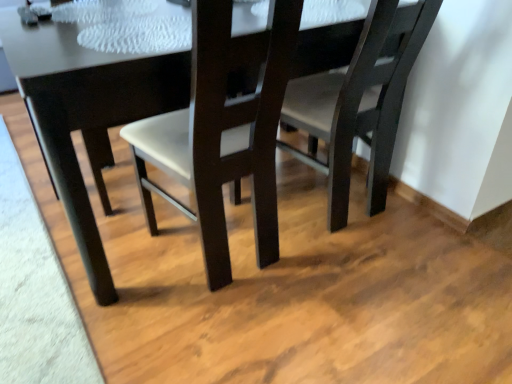
Measure the distance between matte dark wood chair at center, which ranks as the 1th chair in right-to-left order, and camera.

matte dark wood chair at center, which ranks as the 1th chair in right-to-left order, and camera are 3.91 feet apart from each other.

How much space does matte dark wood chair at center, which ranks as the first chair in left-to-right order, occupy vertically?

93.90 centimeters.

Identify the location of matte black table at center. This screenshot has width=512, height=384. (86, 112).

Considering their positions, is matte dark wood chair at center, which ranks as the first chair in left-to-right order, located in front of or behind matte dark wood chair at center, which ranks as the 1th chair in right-to-left order?

Clearly, matte dark wood chair at center, which ranks as the first chair in left-to-right order, is in front of matte dark wood chair at center, which ranks as the 1th chair in right-to-left order.

Looking at this image, from a real-world perspective, which object stands above the other?

matte dark wood chair at center, the second chair when ordered from right to left, is physically above.

In terms of height, does matte dark wood chair at center, the second chair when ordered from right to left, look taller or shorter compared to matte dark wood chair at center, which is counted as the second chair, starting from the left?

Considering their sizes, matte dark wood chair at center, the second chair when ordered from right to left, has more height than matte dark wood chair at center, which is counted as the second chair, starting from the left.

Considering the sizes of matte dark wood chair at center, which is counted as the second chair, starting from the left, and matte dark wood chair at center, the second chair when ordered from right to left, in the image, is matte dark wood chair at center, which is counted as the second chair, starting from the left, wider or thinner than matte dark wood chair at center, the second chair when ordered from right to left,?

Clearly, matte dark wood chair at center, which is counted as the second chair, starting from the left, has less width compared to matte dark wood chair at center, the second chair when ordered from right to left.

Is matte dark wood chair at center, which ranks as the 1th chair in right-to-left order, far from matte dark wood chair at center, the second chair when ordered from right to left?

No, matte dark wood chair at center, which ranks as the 1th chair in right-to-left order, is not far away from matte dark wood chair at center, the second chair when ordered from right to left.

Considering their positions, is matte dark wood chair at center, which is counted as the second chair, starting from the left, located in front of or behind matte dark wood chair at center, which ranks as the first chair in left-to-right order?

Clearly, matte dark wood chair at center, which is counted as the second chair, starting from the left, is behind matte dark wood chair at center, which ranks as the first chair in left-to-right order.

What's the angular difference between matte dark wood chair at center, which ranks as the 1th chair in right-to-left order, and matte dark wood chair at center, the second chair when ordered from right to left,'s facing directions?

The angular difference between matte dark wood chair at center, which ranks as the 1th chair in right-to-left order, and matte dark wood chair at center, the second chair when ordered from right to left, is 3.98 degrees.

From the image's perspective, is matte black table at center on matte dark wood chair at center, the second chair when ordered from right to left?

Yes, from the image's perspective, matte black table at center is on top of matte dark wood chair at center, the second chair when ordered from right to left.

In the image, is matte black table at center on the left side or the right side of matte dark wood chair at center, the second chair when ordered from right to left?

Clearly, matte black table at center is on the left of matte dark wood chair at center, the second chair when ordered from right to left, in the image.

How different are the orientations of matte black table at center and matte dark wood chair at center, the second chair when ordered from right to left, in degrees?

The facing directions of matte black table at center and matte dark wood chair at center, the second chair when ordered from right to left, are 176 degrees apart.

Can you confirm if matte dark wood chair at center, the second chair when ordered from right to left, is shorter than matte black table at center?

No, matte dark wood chair at center, the second chair when ordered from right to left, is not shorter than matte black table at center.

Is matte dark wood chair at center, the second chair when ordered from right to left, situated inside matte black table at center or outside?

matte dark wood chair at center, the second chair when ordered from right to left, lies within the bounds of matte black table at center.

Is matte dark wood chair at center, the second chair when ordered from right to left, facing away from matte black table at center?

Correct, matte dark wood chair at center, the second chair when ordered from right to left, is looking away from matte black table at center.

Between matte dark wood chair at center, the second chair when ordered from right to left, and matte black table at center, which one appears on the left side from the viewer's perspective?

matte black table at center is more to the left.

From a real-world perspective, is matte black table at center positioned above or below matte dark wood chair at center, which ranks as the 1th chair in right-to-left order?

From a real-world perspective, matte black table at center is physically below matte dark wood chair at center, which ranks as the 1th chair in right-to-left order.

Visually, is matte black table at center positioned to the left or to the right of matte dark wood chair at center, which ranks as the 1th chair in right-to-left order?

From the image, it's evident that matte black table at center is to the left of matte dark wood chair at center, which ranks as the 1th chair in right-to-left order.

Can you tell me how much matte black table at center and matte dark wood chair at center, which ranks as the 1th chair in right-to-left order, differ in facing direction?

180 degrees.

Is matte black table at center far from matte dark wood chair at center, which ranks as the 1th chair in right-to-left order?

No, matte black table at center is not far from matte dark wood chair at center, which ranks as the 1th chair in right-to-left order.

Is matte dark wood chair at center, which ranks as the 1th chair in right-to-left order, to the left of matte black table at center from the viewer's perspective?

In fact, matte dark wood chair at center, which ranks as the 1th chair in right-to-left order, is to the right of matte black table at center.

Which of these two, matte dark wood chair at center, which ranks as the 1th chair in right-to-left order, or matte black table at center, is smaller?

matte dark wood chair at center, which ranks as the 1th chair in right-to-left order.

Consider the image. Can you tell me how much matte dark wood chair at center, which ranks as the 1th chair in right-to-left order, and matte black table at center differ in facing direction?

180 degrees.

You are a GUI agent. You are given a task and a screenshot of the screen. Output one action in this format:
    pyautogui.click(x=<x>, y=<y>)
    Task: Click on the table that appears on the left of matte dark wood chair at center, which is counted as the second chair, starting from the left
    The height and width of the screenshot is (384, 512).
    Given the screenshot: What is the action you would take?
    [x=86, y=112]

Image resolution: width=512 pixels, height=384 pixels. What are the coordinates of `chair that appears in front of the matte dark wood chair at center, which ranks as the 1th chair in right-to-left order` in the screenshot? It's located at (221, 135).

Image resolution: width=512 pixels, height=384 pixels. I want to click on chair located on the left of matte dark wood chair at center, which ranks as the 1th chair in right-to-left order, so click(x=221, y=135).

From the image, which object appears to be nearer to matte black table at center, matte dark wood chair at center, which ranks as the 1th chair in right-to-left order, or matte dark wood chair at center, the second chair when ordered from right to left?

Based on the image, matte dark wood chair at center, the second chair when ordered from right to left, appears to be nearer to matte black table at center.

From the image, which object appears to be nearer to matte dark wood chair at center, which ranks as the 1th chair in right-to-left order, matte black table at center or matte dark wood chair at center, the second chair when ordered from right to left?

Based on the image, matte dark wood chair at center, the second chair when ordered from right to left, appears to be nearer to matte dark wood chair at center, which ranks as the 1th chair in right-to-left order.

Based on their spatial positions, is matte black table at center or matte dark wood chair at center, which is counted as the second chair, starting from the left, closer to matte dark wood chair at center, which ranks as the first chair in left-to-right order?

matte black table at center lies closer to matte dark wood chair at center, which ranks as the first chair in left-to-right order, than the other object.

Estimate the real-world distances between objects in this image. Which object is closer to matte dark wood chair at center, which is counted as the second chair, starting from the left, matte dark wood chair at center, the second chair when ordered from right to left, or matte black table at center?

matte dark wood chair at center, the second chair when ordered from right to left, is closer to matte dark wood chair at center, which is counted as the second chair, starting from the left.

When comparing their distances from matte dark wood chair at center, the second chair when ordered from right to left, does matte dark wood chair at center, which ranks as the 1th chair in right-to-left order, or matte black table at center seem closer?

Among the two, matte black table at center is located nearer to matte dark wood chair at center, the second chair when ordered from right to left.

Estimate the real-world distances between objects in this image. Which object is further from matte black table at center, matte dark wood chair at center, which ranks as the first chair in left-to-right order, or matte dark wood chair at center, which ranks as the 1th chair in right-to-left order?

matte dark wood chair at center, which ranks as the 1th chair in right-to-left order, is further to matte black table at center.

Where is `chair between matte black table at center and matte dark wood chair at center, which is counted as the second chair, starting from the left`? chair between matte black table at center and matte dark wood chair at center, which is counted as the second chair, starting from the left is located at coordinates (221, 135).